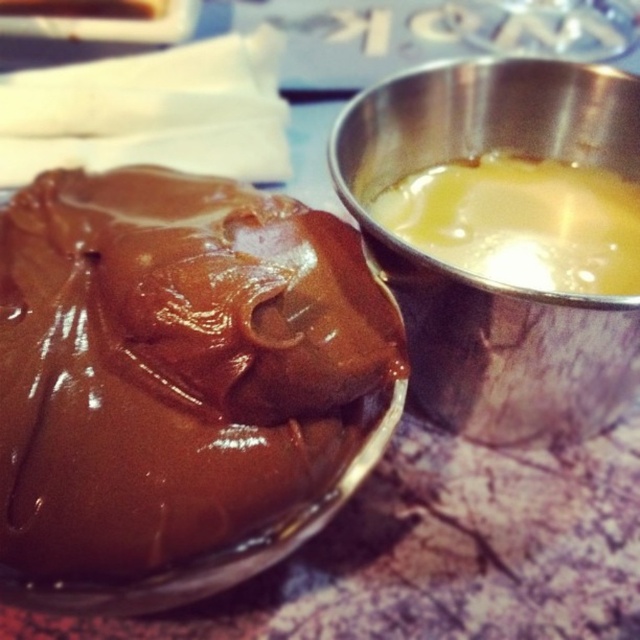
Question: Which of the following is the farthest from the observer?

Choices:
 (A) (77, 285)
 (B) (477, 317)
 (C) (534, 282)

Answer: (C)

Question: Observing the image, what is the correct spatial positioning of shiny brown chocolate at left in reference to yellow translucent liquid at upper right?

Choices:
 (A) left
 (B) right

Answer: (A)

Question: Is metallic yellow liquid at upper right thinner than yellow translucent liquid at upper right?

Choices:
 (A) no
 (B) yes

Answer: (A)

Question: Does shiny brown chocolate at left appear on the right side of yellow translucent liquid at upper right?

Choices:
 (A) yes
 (B) no

Answer: (B)

Question: Which point is closer to the camera?

Choices:
 (A) (600, 353)
 (B) (637, 224)
 (C) (333, 218)

Answer: (C)

Question: Among these objects, which one is farthest from the camera?

Choices:
 (A) metallic yellow liquid at upper right
 (B) yellow translucent liquid at upper right

Answer: (B)